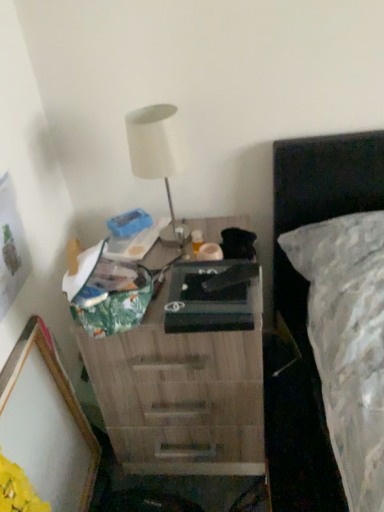
Question: From a real-world perspective, does white matte table lamp at upper center sit lower than wooden nightstand at center?

Choices:
 (A) yes
 (B) no

Answer: (B)

Question: Is white matte table lamp at upper center at the left side of wooden nightstand at center?

Choices:
 (A) yes
 (B) no

Answer: (A)

Question: Is white matte table lamp at upper center shorter than wooden nightstand at center?

Choices:
 (A) no
 (B) yes

Answer: (B)

Question: Could you tell me if white matte table lamp at upper center is turned towards wooden nightstand at center?

Choices:
 (A) no
 (B) yes

Answer: (A)

Question: From the image's perspective, is white matte table lamp at upper center located beneath wooden nightstand at center?

Choices:
 (A) no
 (B) yes

Answer: (A)

Question: Considering the relative sizes of white matte table lamp at upper center and wooden nightstand at center in the image provided, is white matte table lamp at upper center wider than wooden nightstand at center?

Choices:
 (A) yes
 (B) no

Answer: (B)

Question: From a real-world perspective, is white matte table lamp at upper center below wooden picture frame at lower left?

Choices:
 (A) no
 (B) yes

Answer: (A)

Question: Considering the relative sizes of white matte table lamp at upper center and wooden picture frame at lower left in the image provided, is white matte table lamp at upper center taller than wooden picture frame at lower left?

Choices:
 (A) yes
 (B) no

Answer: (B)

Question: From the image's perspective, is white matte table lamp at upper center under wooden picture frame at lower left?

Choices:
 (A) no
 (B) yes

Answer: (A)

Question: Does white matte table lamp at upper center lie in front of wooden picture frame at lower left?

Choices:
 (A) yes
 (B) no

Answer: (B)

Question: Is white matte table lamp at upper center turned away from wooden picture frame at lower left?

Choices:
 (A) yes
 (B) no

Answer: (B)

Question: Does white matte table lamp at upper center have a lesser width compared to wooden picture frame at lower left?

Choices:
 (A) yes
 (B) no

Answer: (B)

Question: Would you say wooden nightstand at center is outside white matte table lamp at upper center?

Choices:
 (A) no
 (B) yes

Answer: (B)